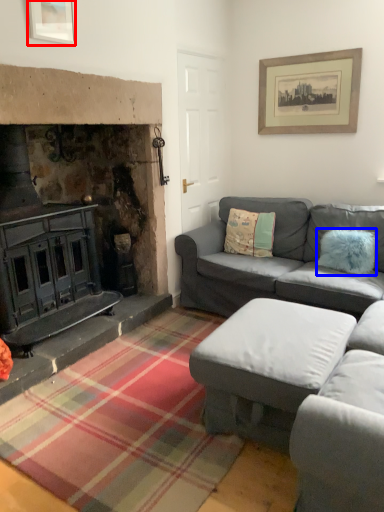
Question: Among these objects, which one is nearest to the camera, picture frame (highlighted by a red box) or pillow (highlighted by a blue box)?

Choices:
 (A) picture frame
 (B) pillow

Answer: (A)